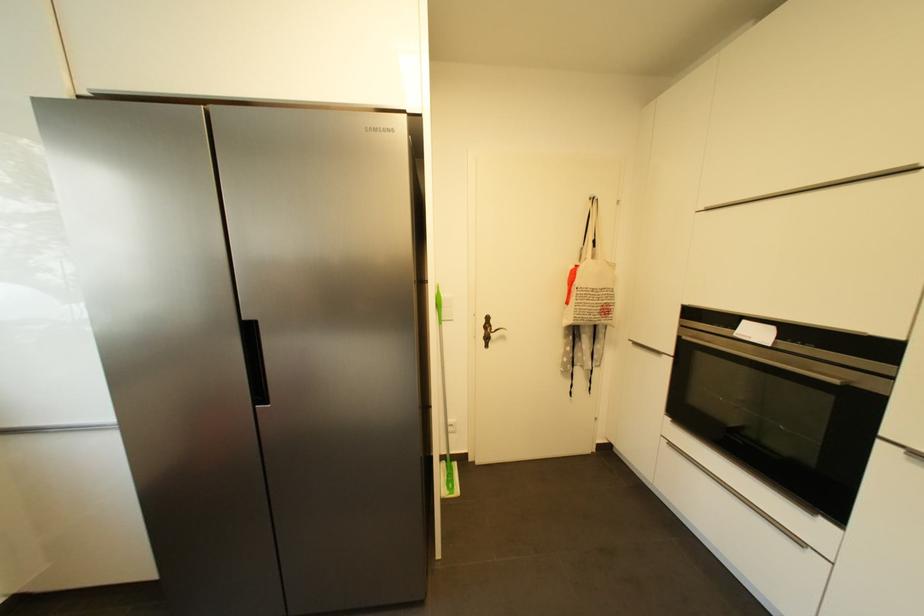
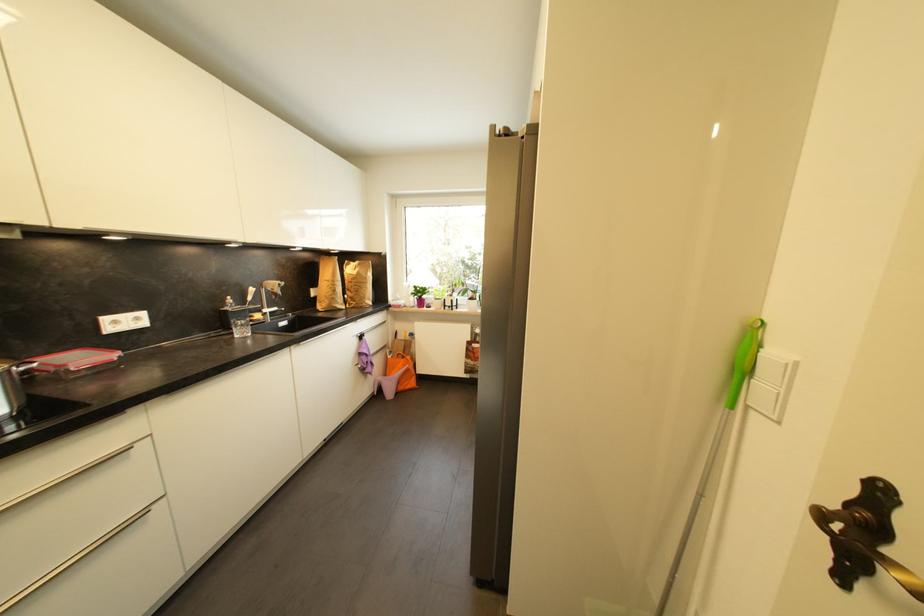
Locate, in the second image, the point that corresponds to [492,347] in the first image.

(846, 581)